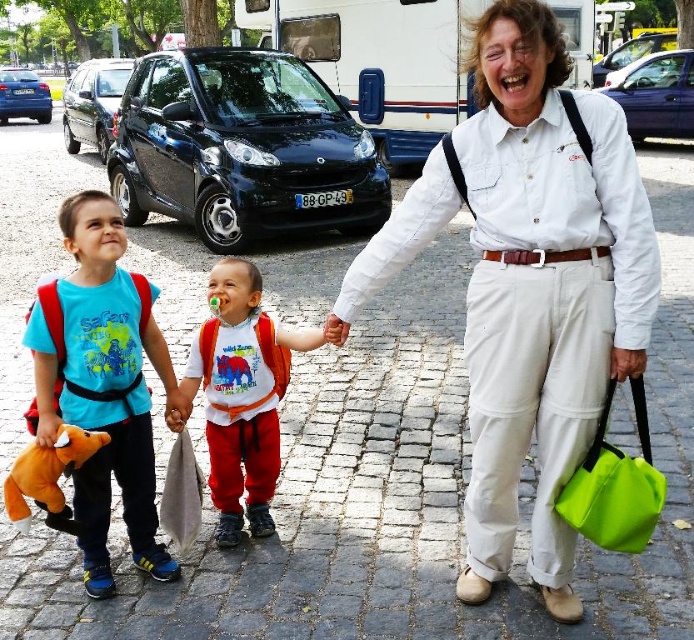
You are a photographer trying to capture a candid shot of the two objects at the center of the image. The white cotton shirt at center and the orange fabric backpack at center are both in focus. Which object appears larger in your photo?

→ The white cotton shirt at center appears larger in the photo because it is bigger than the orange fabric backpack at center.

You are a photographer trying to capture a candid shot of the scene. You notice the white cotton shirt at center and the soft plush toy at left. Which object should you focus on if you want to include both in your frame but prioritize the wider subject?

You should focus on the white cotton shirt at center because its width surpasses that of the soft plush toy at left, making it the wider subject in the scene.